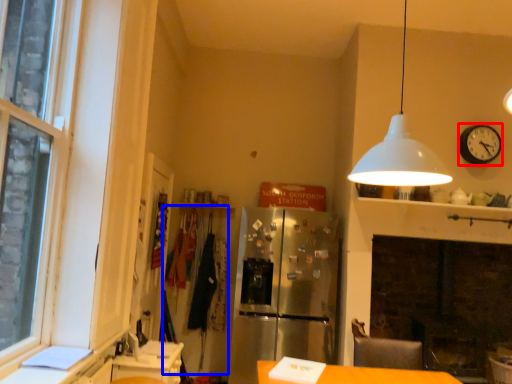
Question: Which point is closer to the camera, clock (highlighted by a red box) or laundry (highlighted by a blue box)?

Choices:
 (A) clock
 (B) laundry

Answer: (A)